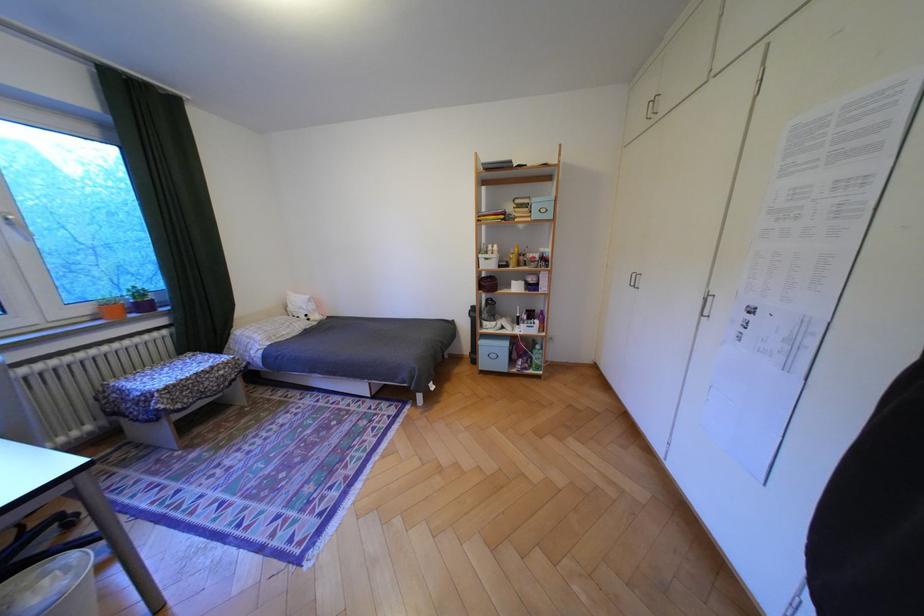
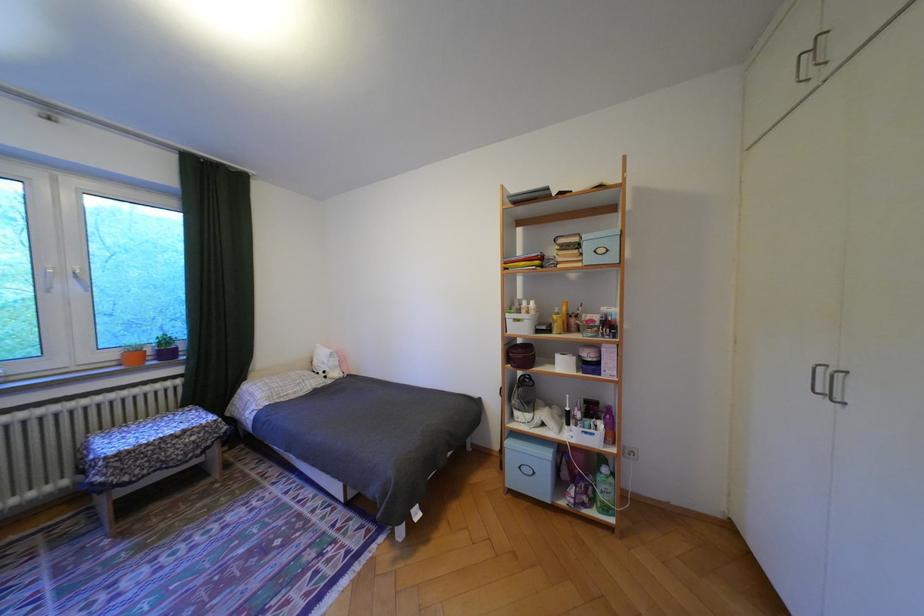
Question: The camera is either moving clockwise (left) or counter-clockwise (right) around the object. The first image is from the beginning of the video and the second image is from the end. Is the camera moving left or right when shooting the video?

Choices:
 (A) Left
 (B) Right

Answer: (B)